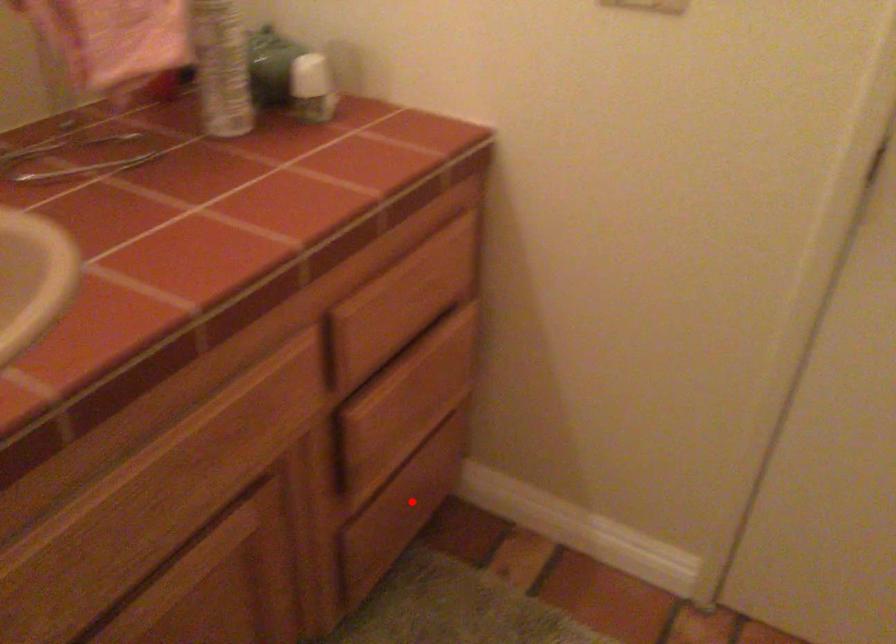
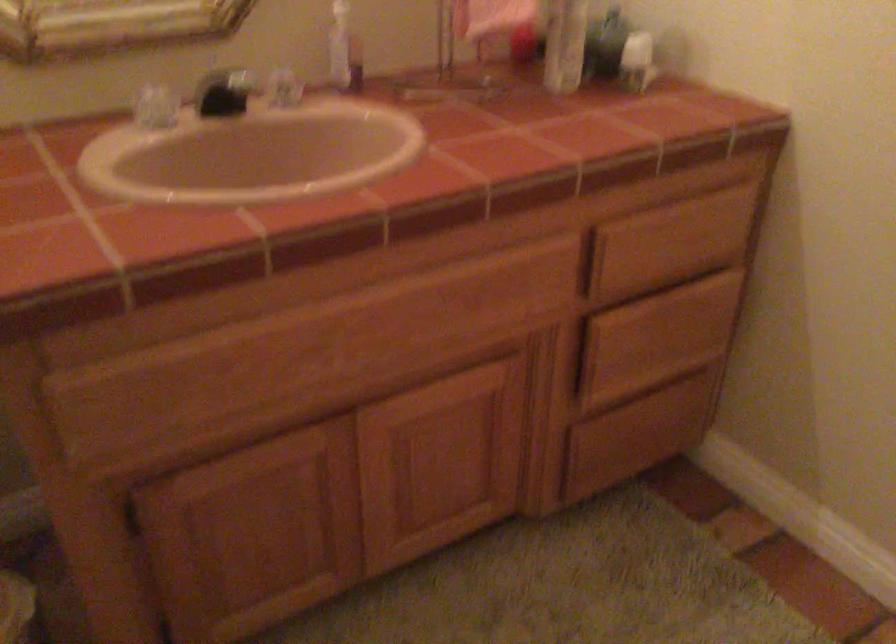
Where in the second image is the point corresponding to the highlighted location from the first image?

(639, 433)